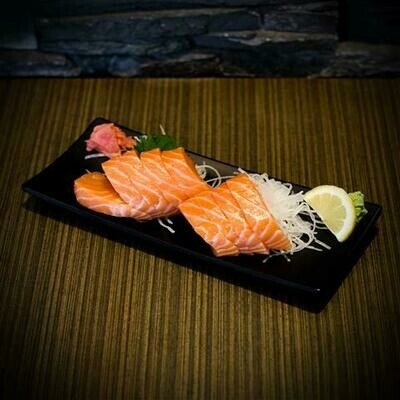
The image size is (400, 400). I want to click on wooden table, so coord(95,371).